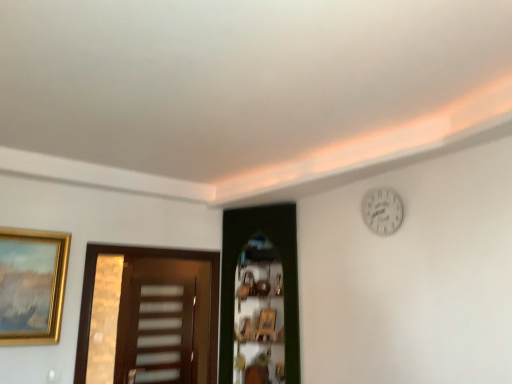
Question: From the image's perspective, is brown wooden door at left, which appears as the first door when viewed from the left, positioned above or below translucent plastic screen door at center?

Choices:
 (A) above
 (B) below

Answer: (A)

Question: Is brown wooden door at left, which appears as the first door when viewed from the left, spatially inside translucent plastic screen door at center, or outside of it?

Choices:
 (A) inside
 (B) outside

Answer: (B)

Question: Which object is positioned closest to the brown wooden door at left, which appears as the first door when viewed from the left?

Choices:
 (A) translucent plastic screen door at center
 (B) gold metallic picture frame at left
 (C) green wooden door at center, which ranks as the second door in left-to-right order
 (D) white matte clock at upper right

Answer: (A)

Question: Considering the real-world distances, which object is farthest from the brown wooden door at left, the 2th door from the right?

Choices:
 (A) green wooden door at center, which ranks as the 1th door in right-to-left order
 (B) gold metallic picture frame at left
 (C) translucent plastic screen door at center
 (D) white matte clock at upper right

Answer: (D)